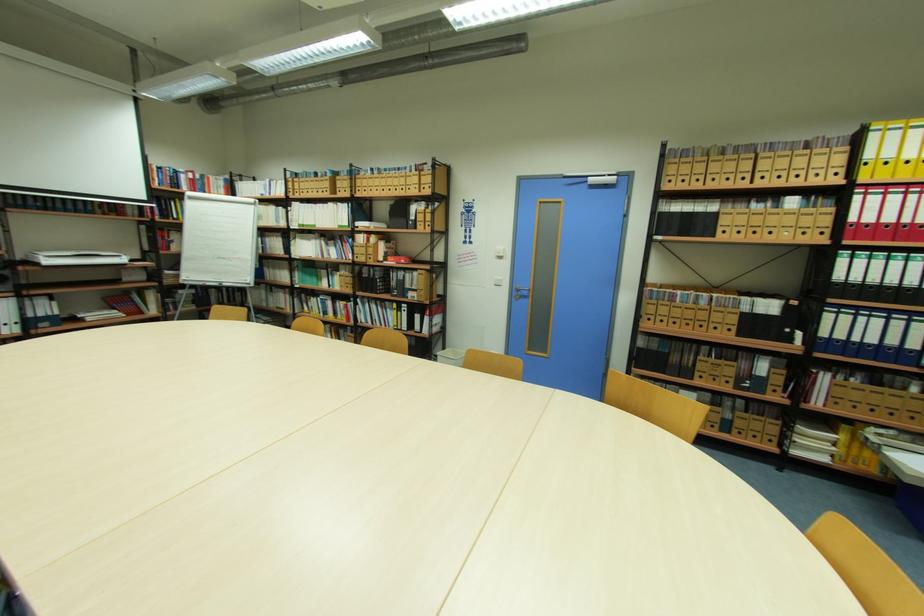
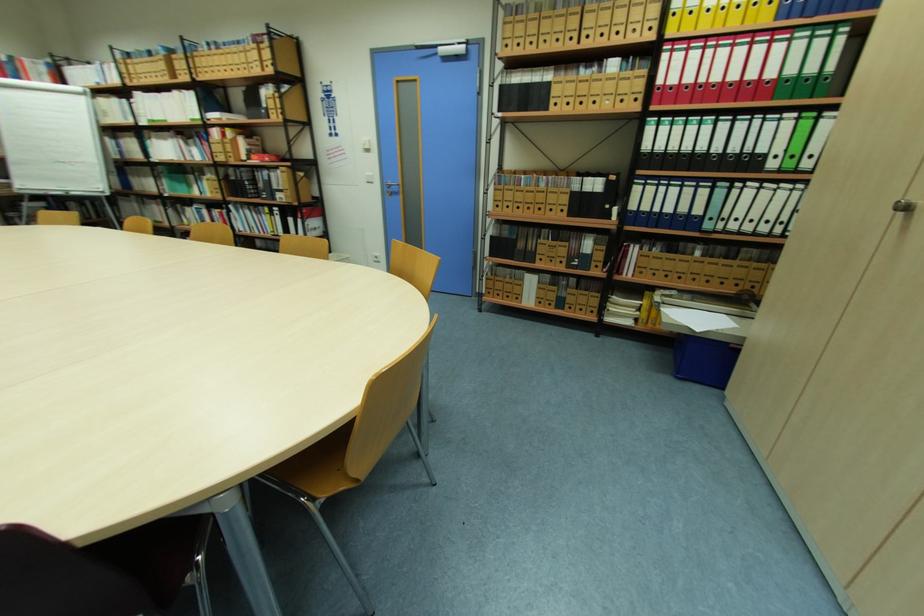
Question: What movement of the cameraman would produce the second image?

Choices:
 (A) Left
 (B) Right
 (C) Forward
 (D) Backward

Answer: (B)